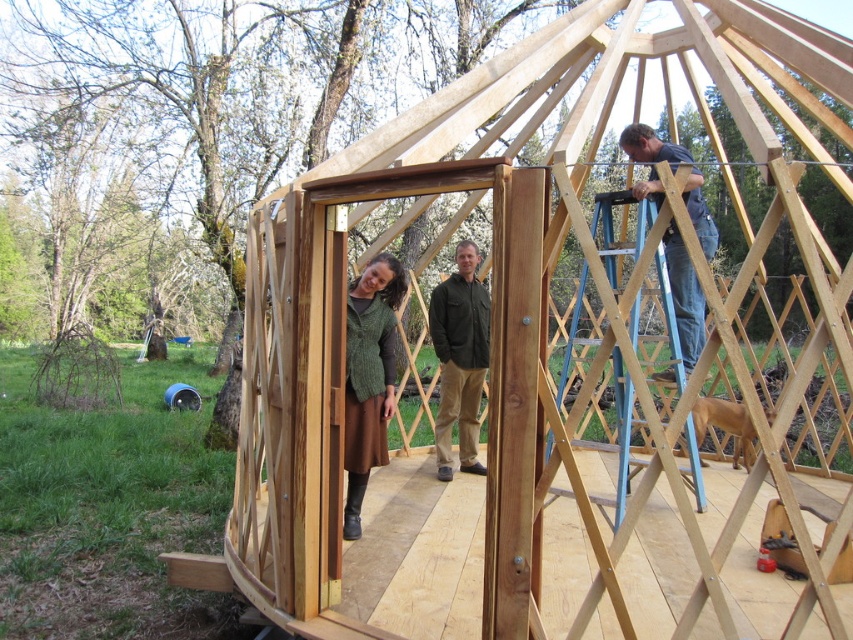
Question: Which point appears farthest from the camera in this image?

Choices:
 (A) (457, 312)
 (B) (346, 310)

Answer: (A)

Question: Can you confirm if green knitted sweater at center is bigger than green matte jacket at center?

Choices:
 (A) no
 (B) yes

Answer: (B)

Question: Which is farther from the smooth light brown wood at upper right?

Choices:
 (A) green knitted sweater at center
 (B) knitted green sweater at center
 (C) green matte jacket at center

Answer: (A)

Question: Which point appears farthest from the camera in this image?

Choices:
 (A) 460,387
 (B) 672,170
 (C) 476,369

Answer: (A)

Question: Does knitted green sweater at center have a larger size compared to green knitted sweater at center?

Choices:
 (A) yes
 (B) no

Answer: (B)

Question: Is knitted green sweater at center smaller than green matte jacket at center?

Choices:
 (A) yes
 (B) no

Answer: (A)